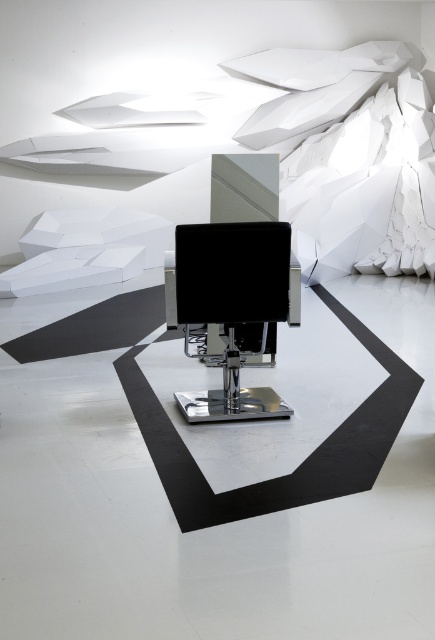
Question: Among these points, which one is nearest to the camera?

Choices:
 (A) (176, 228)
 (B) (285, 410)

Answer: (A)

Question: Is black leather sewing machine at center wider than black glossy monitor at center?

Choices:
 (A) yes
 (B) no

Answer: (A)

Question: Considering the relative positions of black leather sewing machine at center and black glossy monitor at center in the image provided, where is black leather sewing machine at center located with respect to black glossy monitor at center?

Choices:
 (A) left
 (B) right

Answer: (B)

Question: Can you confirm if black leather sewing machine at center is smaller than black glossy monitor at center?

Choices:
 (A) yes
 (B) no

Answer: (B)

Question: Among these points, which one is nearest to the camera?

Choices:
 (A) (204, 280)
 (B) (237, 408)

Answer: (A)